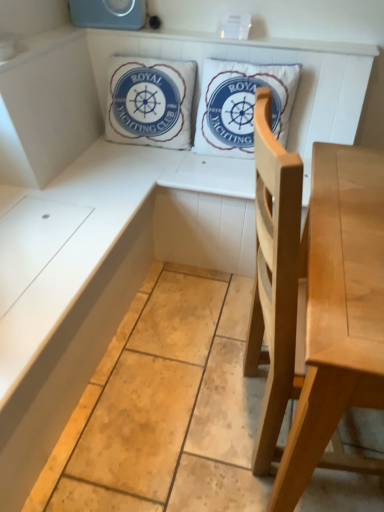
Question: From the image's perspective, is white cotton cushion at upper center, the 1th pillow from the left, above or below light wood chair at center?

Choices:
 (A) above
 (B) below

Answer: (A)

Question: Visually, is white cotton cushion at upper center, the 1th pillow from the left, positioned to the left or to the right of light wood chair at center?

Choices:
 (A) left
 (B) right

Answer: (A)

Question: Considering the real-world distances, which object is farthest from the white cotton cushion at upper center, the 1th pillow from the left?

Choices:
 (A) light wood chair at center
 (B) white cotton pillow at upper center, which is the first pillow in right-to-left order

Answer: (A)

Question: Which object is the farthest from the white cotton cushion at upper center, the 1th pillow from the left?

Choices:
 (A) white cotton pillow at upper center, which is the first pillow in right-to-left order
 (B) light wood chair at center

Answer: (B)